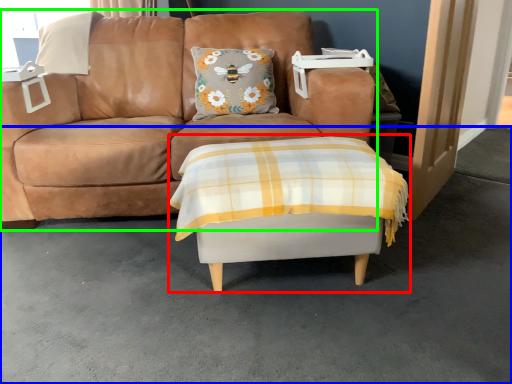
Question: Based on their relative distances, which object is farther from table (highlighted by a red box)? Choose from concrete (highlighted by a blue box) and studio couch (highlighted by a green box).

Choices:
 (A) concrete
 (B) studio couch

Answer: (B)